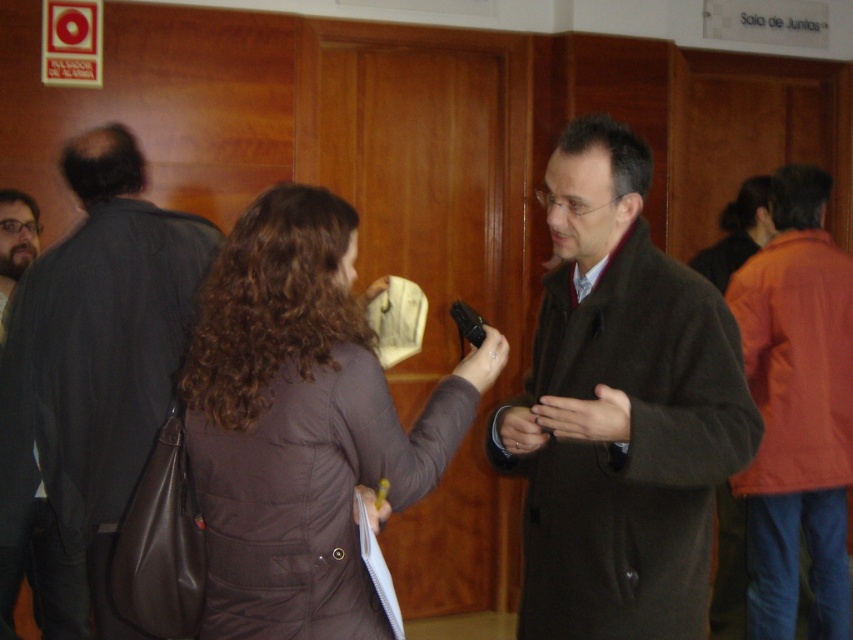
Does brown puffy coat at center appear on the left side of dark gray coat at left?

Incorrect, brown puffy coat at center is not on the left side of dark gray coat at left.

Does brown puffy coat at center have a smaller size compared to dark gray coat at left?

Yes.

The height and width of the screenshot is (640, 853). What do you see at coordinates (300, 424) in the screenshot? I see `brown puffy coat at center` at bounding box center [300, 424].

At what (x,y) coordinates should I click in order to perform the action: click on brown puffy coat at center. Please return your answer as a coordinate pair (x, y). The width and height of the screenshot is (853, 640). Looking at the image, I should click on (300, 424).

Can you confirm if brown wool coat at center is bigger than dark gray coat at left?

Actually, brown wool coat at center might be smaller than dark gray coat at left.

Who is more distant from viewer, [645,596] or [138,172]?

Point [138,172]

I want to click on brown wool coat at center, so click(619, 412).

Find the location of a particular element. This screenshot has height=640, width=853. brown wool coat at center is located at coordinates (619, 412).

Does brown wool coat at center have a greater height compared to brown puffy coat at center?

Yes.

Who is shorter, brown wool coat at center or brown puffy coat at center?

brown puffy coat at center is shorter.

This screenshot has height=640, width=853. Find the location of `brown wool coat at center`. brown wool coat at center is located at coordinates (619, 412).

Locate an element on the screen. This screenshot has height=640, width=853. brown wool coat at center is located at coordinates (619, 412).